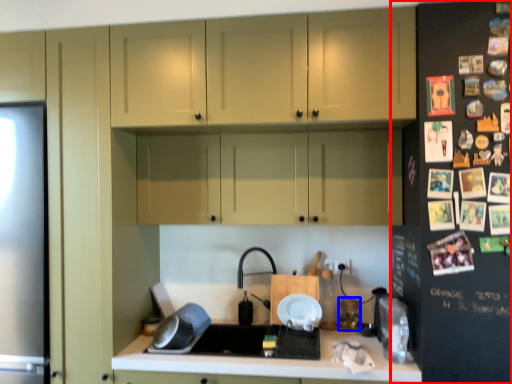
Question: Which of the following is the farthest to the observer, fridge (highlighted by a red box) or appliance (highlighted by a blue box)?

Choices:
 (A) fridge
 (B) appliance

Answer: (B)